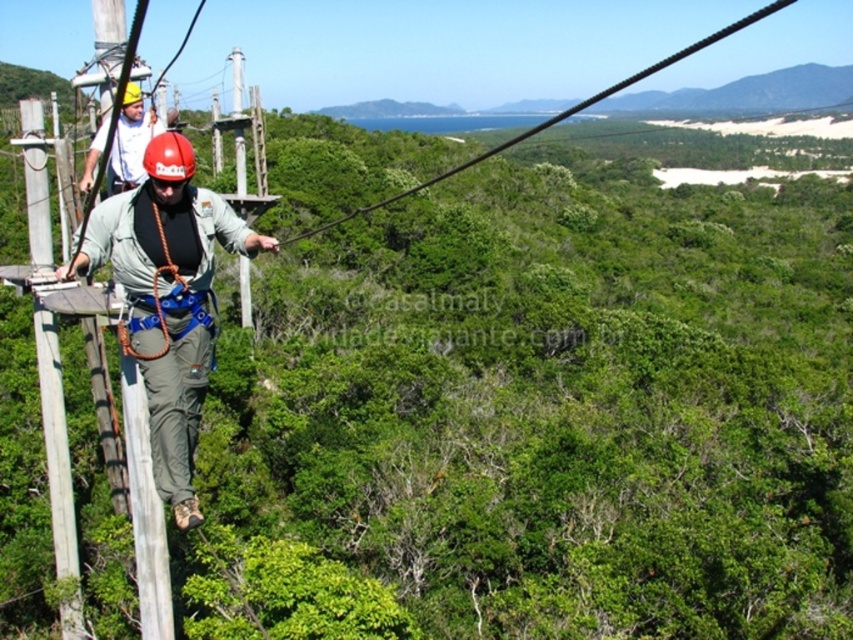
Question: Which of the following is the closest to the observer?

Choices:
 (A) matte yellow helmet at upper left
 (B) black wire at upper center

Answer: (A)

Question: Among these objects, which one is nearest to the camera?

Choices:
 (A) black wire at upper center
 (B) matte khaki pants at center

Answer: (B)

Question: Does matte khaki pants at center have a lesser width compared to black wire at upper center?

Choices:
 (A) yes
 (B) no

Answer: (A)

Question: Is matte khaki pants at center behind matte yellow helmet at upper left?

Choices:
 (A) yes
 (B) no

Answer: (A)

Question: Which of the following is the closest to the observer?

Choices:
 (A) matte khaki pants at center
 (B) black wire at upper center

Answer: (A)

Question: Does matte khaki pants at center have a lesser width compared to black wire at upper center?

Choices:
 (A) no
 (B) yes

Answer: (B)